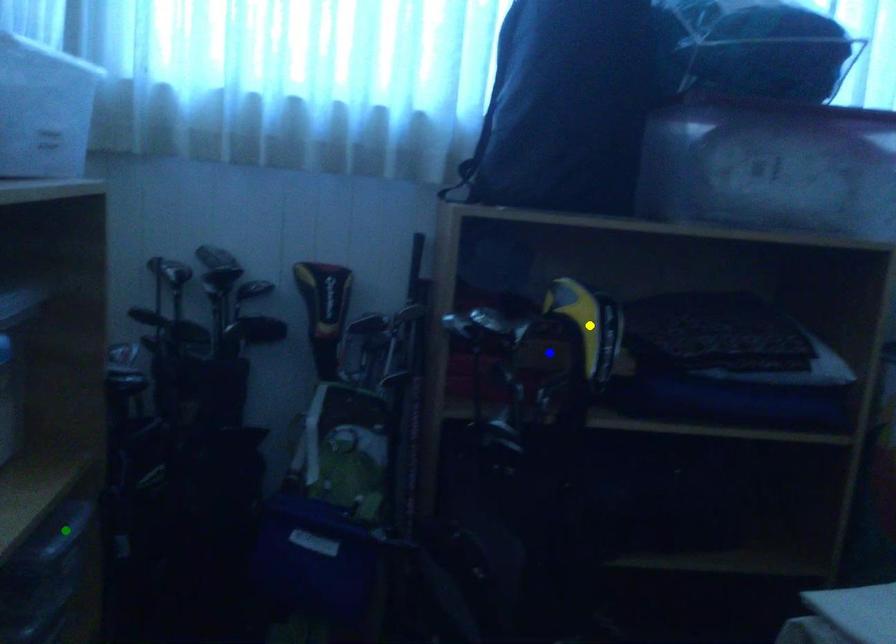
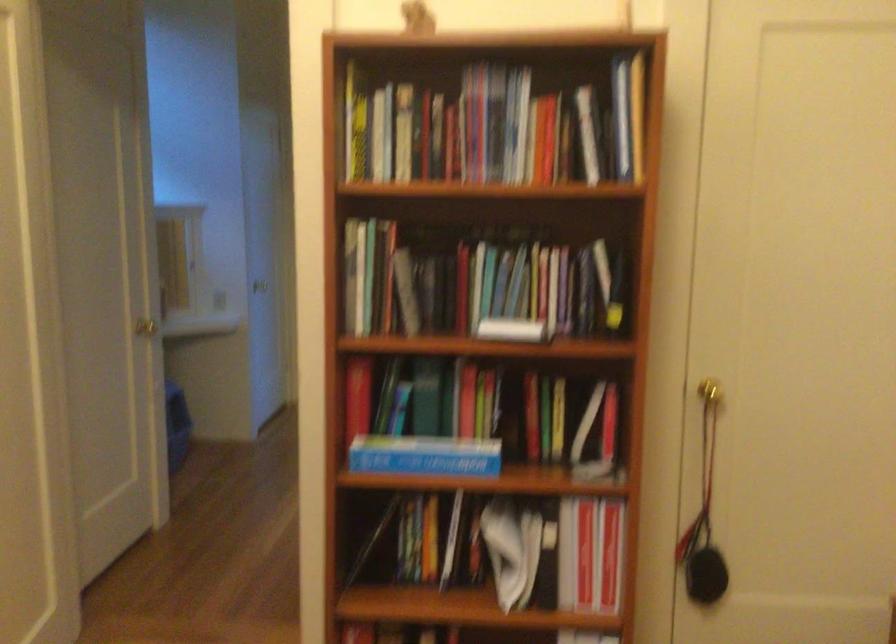
I am providing you with two images of the same scene from different viewpoints. Three points are marked in image1. Which point corresponds to a part or object that is occluded in image2?In image1, three points are marked. Which of them correspond to a part or object that is occluded in image2?Among the three points shown in image1, which one corresponds to a part or object that is no longer visible due to occlusion in image2?

green point, yellow point, blue point cannot be seen in image2.